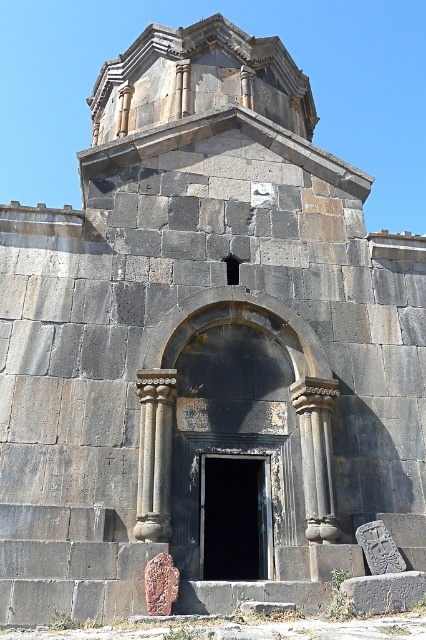
You are an architect examining the historical stone structure. You notice two columns, the dark gray stone column at center and the black stone column at center. Which column is positioned to the left when viewed from the front of the building?

The dark gray stone column at center is positioned to the left of the black stone column at center when viewed from the front of the building.

You are an architect examining the historical stone structure. You notice the black stone door at center and the black stone column at center. Which object is positioned lower in the structure?

The black stone door at center is positioned lower than the black stone column at center.